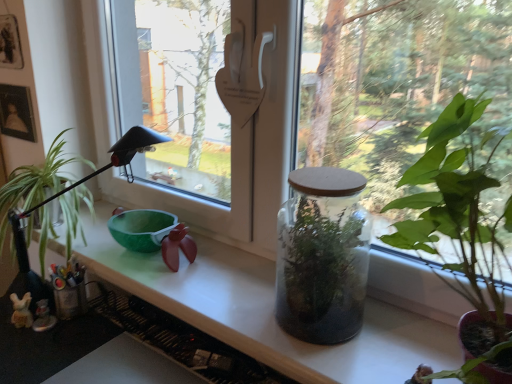
Question: Considering the positions of translucent glass terrarium at center, arranged as the 1th houseplant when viewed from the front, and transparent glass jar at center in the image, is translucent glass terrarium at center, arranged as the 1th houseplant when viewed from the front, bigger or smaller than transparent glass jar at center?

Choices:
 (A) big
 (B) small

Answer: (B)

Question: From a real-world perspective, is translucent glass terrarium at center, the 2th houseplant from the left, physically located above or below transparent glass jar at center?

Choices:
 (A) below
 (B) above

Answer: (A)

Question: Based on their relative distances, which object is nearer to the transparent glass jar at center?

Choices:
 (A) translucent glass jar at center
 (B) transparent glass jar at center
 (C) translucent glass terrarium at center, which appears as the 2th houseplant when viewed from the back
 (D) green glossy houseplant at left, the 1th houseplant in the back-to-front sequence

Answer: (B)

Question: Which of these objects is positioned farthest from the translucent glass terrarium at center, the 2th houseplant from the left?

Choices:
 (A) translucent glass jar at center
 (B) transparent glass jar at center
 (C) transparent glass jar at center
 (D) green glossy houseplant at left, the 1th houseplant in the back-to-front sequence

Answer: (D)